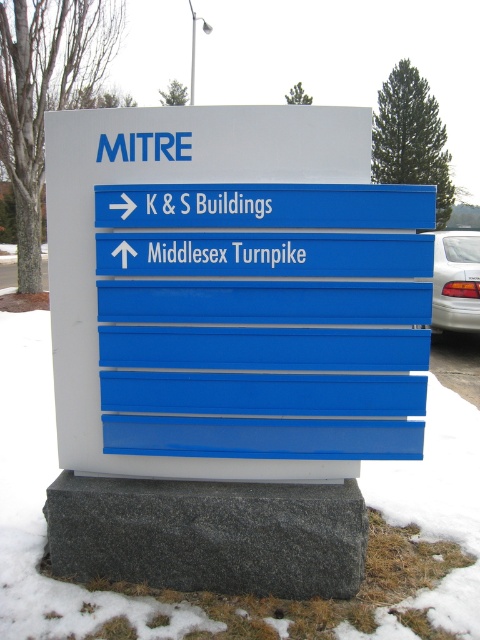
You are driving a car and see the blue plastic sign at center and the white glossy sedan at right. Which object is closer to you?

The blue plastic sign at center is closer to you because it is in front of the white glossy sedan at right.

You are standing in front of the blue plastic sign at center and want to reach the Middlesex Turnpike. The distance between you and the sign is 1.5 meters. If you walk straight ahead, will you reach the Middlesex Turnpike?

The blue plastic sign at center has an arrow pointing straight ahead towards Middlesex Turnpike, so walking straight ahead will lead you to Middlesex Turnpike.

You are driving a car and see the blue plastic sign at center and the white glossy sedan at right ahead. Which object is closer to the left side of your view?

The blue plastic sign at center is to the left of the white glossy sedan at right, so it is closer to the left side of your view.